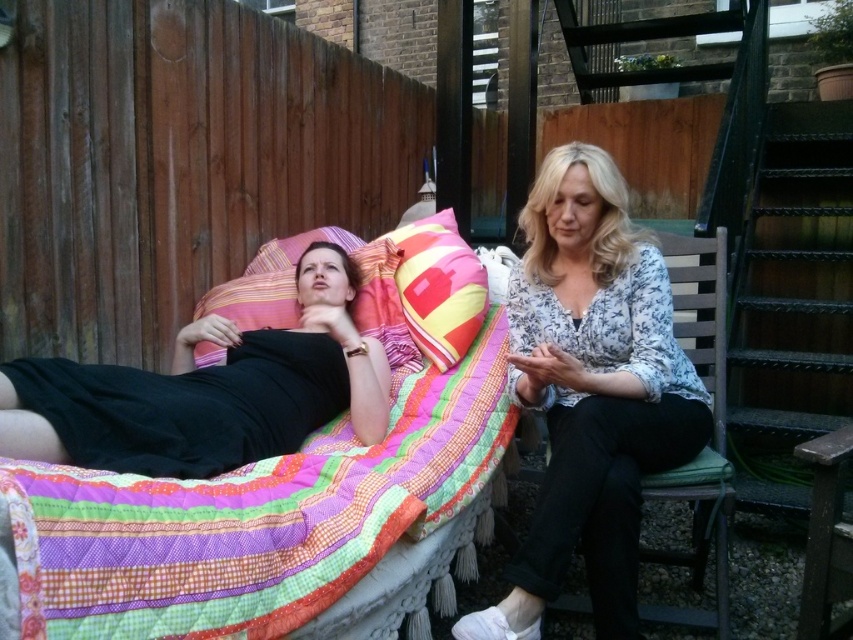
Is point (341, 426) less distant than point (212, 300)?

Yes, it is in front of point (212, 300).

Is quilted cotton blanket at center wider than striped fabric pillow at upper left?

Yes.

This screenshot has width=853, height=640. Identify the location of quilted cotton blanket at center. (256, 516).

Between floral blouse at center and black matte dress at center, which one has less height?

black matte dress at center is shorter.

Does floral blouse at center have a lesser height compared to black matte dress at center?

No, floral blouse at center is not shorter than black matte dress at center.

Is point (552, 148) closer to camera compared to point (177, 355)?

No, it is not.

Identify the location of floral blouse at center. (590, 390).

Does quilted cotton blanket at center have a smaller size compared to multicolored quilted pillow at center?

Actually, quilted cotton blanket at center might be larger than multicolored quilted pillow at center.

Does quilted cotton blanket at center appear over multicolored quilted pillow at center?

Incorrect, quilted cotton blanket at center is not positioned above multicolored quilted pillow at center.

Based on the photo, who is more distant from viewer, (80,625) or (474,264)?

Point (474,264)

You are a GUI agent. You are given a task and a screenshot of the screen. Output one action in this format:
    pyautogui.click(x=<x>, y=<y>)
    Task: Click on the quilted cotton blanket at center
    
    Given the screenshot: What is the action you would take?
    pyautogui.click(x=256, y=516)